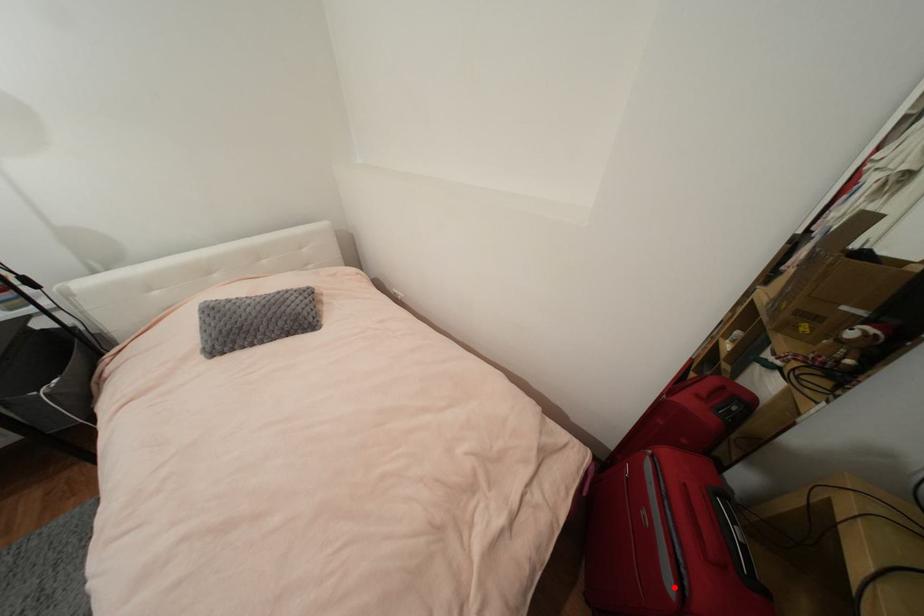
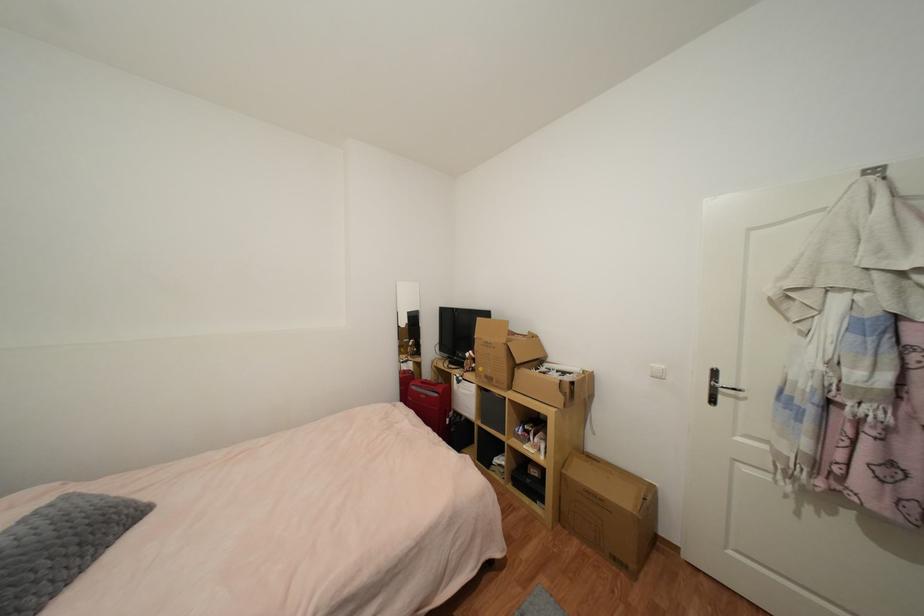
Question: I am providing you with two images of the same scene from different viewpoints. Image1 has a red point marked. In image2, the corresponding 3D location appears at what relative position? Reply with the corresponding letter.

Choices:
 (A) Closer
 (B) Farther

Answer: (B)